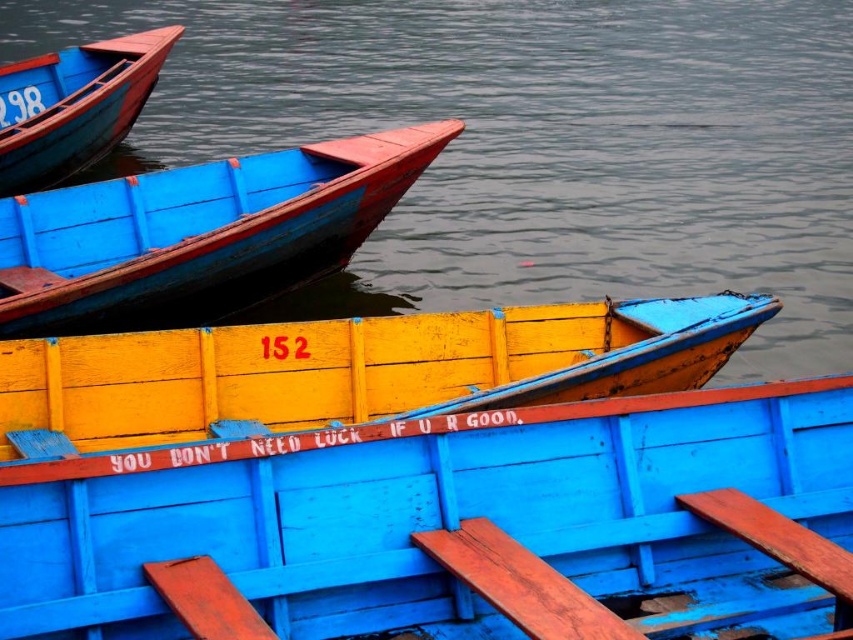
You are a photographer planning to take a photo of the smooth water at boat center and the matte blue wooden boat at center. Based on their positions, which object will appear larger in the photo?

The smooth water at boat center will appear larger in the photo because it is much taller than the matte blue wooden boat at center.

You are standing on the dock and see the smooth water at boat center and the matte blue wooden boat at upper left. Which object is higher in the image?

The smooth water at boat center is much taller than the matte blue wooden boat at upper left, so the smooth water at boat center is higher in the image.